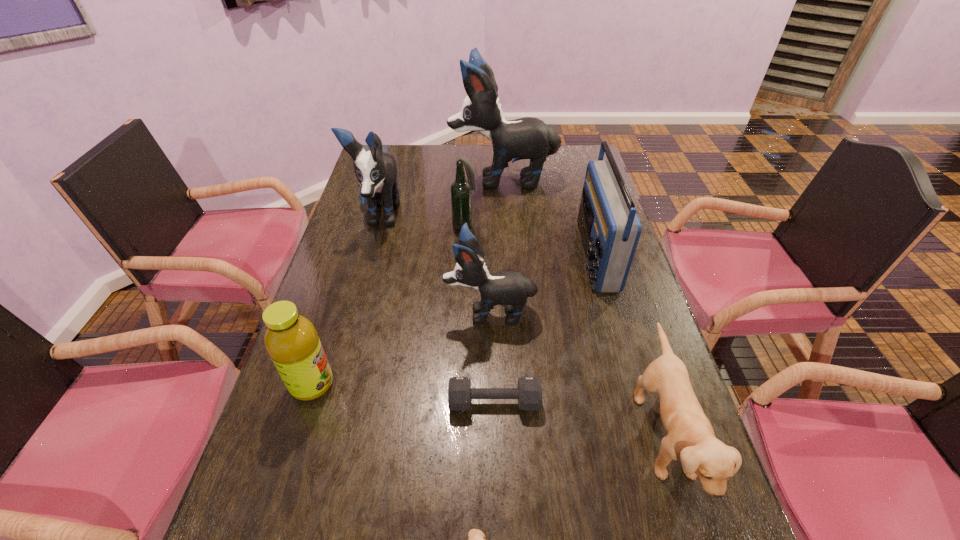
Identify the location of the second shortest puppy. This screenshot has height=540, width=960. (691, 439).

This screenshot has width=960, height=540. Identify the location of the shortest object. (529, 392).

Locate an element on the screen. gray dumbbell is located at coordinates (529, 392).

This screenshot has width=960, height=540. I want to click on free space located 0.270m on the front-facing side of the tallest puppy, so click(378, 179).

Locate an element on the screen. The height and width of the screenshot is (540, 960). blank area located on the front-facing side of the tallest puppy is located at coordinates pos(407,179).

Where is `free space located 0.220m on the front-facing side of the tallest puppy`? The image size is (960, 540). free space located 0.220m on the front-facing side of the tallest puppy is located at coordinates (392, 179).

At what (x,y) coordinates should I click in order to perform the action: click on free spot located 0.280m on the front-facing side of the second biggest black puppy. Please return your answer as a coordinate pair (x, y). This screenshot has height=540, width=960. Looking at the image, I should click on (351, 315).

Where is `vacant space located 0.050m on the front panel of the radio receiver`? This screenshot has width=960, height=540. vacant space located 0.050m on the front panel of the radio receiver is located at coordinates (563, 255).

The image size is (960, 540). Identify the location of vacant point located on the front panel of the radio receiver. (471, 255).

You are a GUI agent. You are given a task and a screenshot of the screen. Output one action in this format:
    pyautogui.click(x=<x>, y=<y>)
    Task: Click on the free spot located 0.280m on the front panel of the radio receiver
    
    Given the screenshot: What is the action you would take?
    pyautogui.click(x=488, y=255)